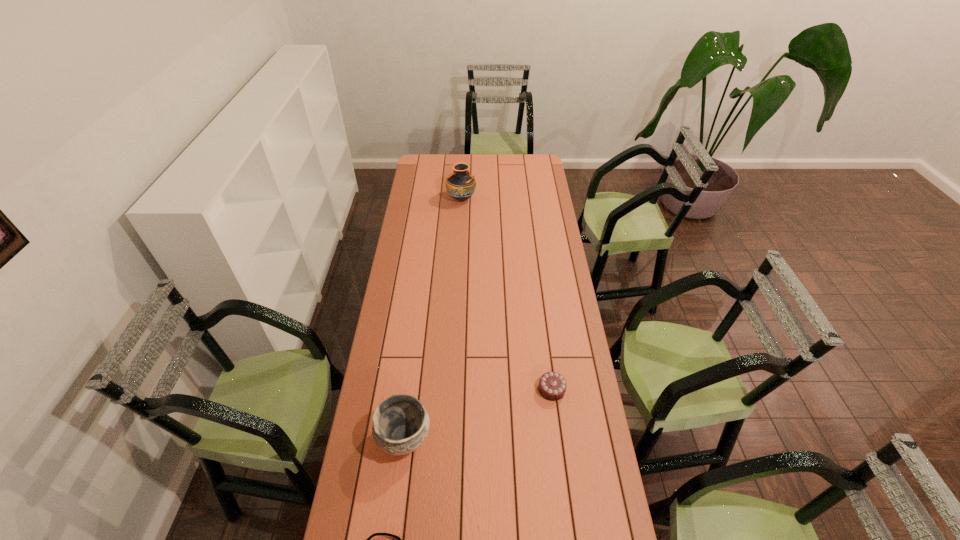
At what (x,y) coordinates should I click in order to perform the action: click on the tallest object. Please return your answer as a coordinate pair (x, y). The width and height of the screenshot is (960, 540). Looking at the image, I should click on (460, 185).

At what (x,y) coordinates should I click in order to perform the action: click on the taller pottery. Please return your answer as a coordinate pair (x, y). Looking at the image, I should click on 460,185.

The width and height of the screenshot is (960, 540). Identify the location of the shorter pottery. (400, 423).

Locate an element on the screen. Image resolution: width=960 pixels, height=540 pixels. the nearer pottery is located at coordinates (400, 423).

Identify the location of chocolate cake. (552, 386).

This screenshot has width=960, height=540. Identify the location of the third tallest object. (552, 386).

Find the location of a particular element. This screenshot has height=540, width=960. blank space located 0.120m on the front of the tallest object is located at coordinates (460, 221).

The image size is (960, 540). Find the location of `blank space located 0.170m on the back of the nearer pottery`. blank space located 0.170m on the back of the nearer pottery is located at coordinates (413, 370).

The image size is (960, 540). Find the location of `blank area located 0.170m on the back of the third tallest object`. blank area located 0.170m on the back of the third tallest object is located at coordinates (545, 341).

Image resolution: width=960 pixels, height=540 pixels. In order to click on object present at the left edge in this screenshot , I will do `click(400, 423)`.